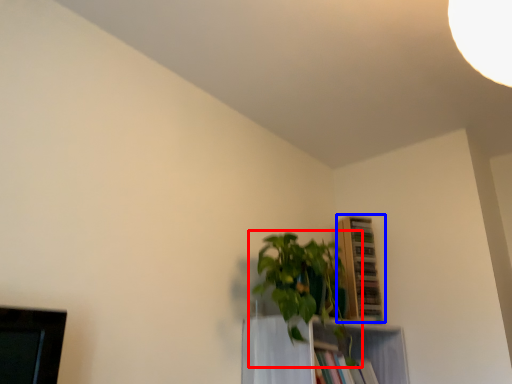
Question: Among these objects, which one is farthest to the camera, houseplant (highlighted by a red box) or shelf (highlighted by a blue box)?

Choices:
 (A) houseplant
 (B) shelf

Answer: (B)